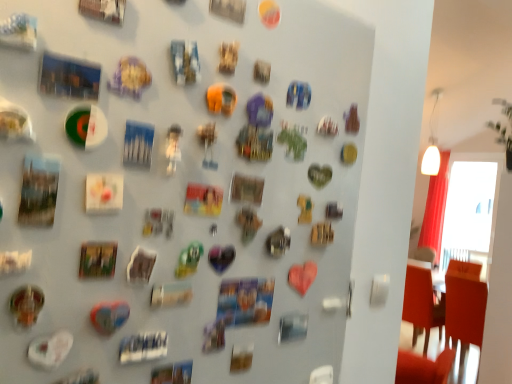
Question: Does orange fabric chair at right lie behind shiny metallic heart at center, which appears as the first art when ordered from the bottom?

Choices:
 (A) no
 (B) yes

Answer: (B)

Question: Can you confirm if orange fabric chair at right is bigger than shiny metallic heart at center, which appears as the first art when ordered from the bottom?

Choices:
 (A) no
 (B) yes

Answer: (B)

Question: From the image's perspective, would you say orange fabric chair at right is shown under shiny metallic heart at center, acting as the 6th art starting from the top?

Choices:
 (A) yes
 (B) no

Answer: (A)

Question: Does orange fabric chair at right appear on the right side of shiny metallic heart at center, acting as the 6th art starting from the top?

Choices:
 (A) no
 (B) yes

Answer: (B)

Question: Is orange fabric chair at right surrounding shiny metallic heart at center, acting as the 6th art starting from the top?

Choices:
 (A) yes
 (B) no

Answer: (B)

Question: From the image's perspective, is orange fabric chair at right on top of shiny metallic heart at center, which appears as the first art when ordered from the bottom?

Choices:
 (A) no
 (B) yes

Answer: (A)

Question: From a real-world perspective, is orange fabric chair at right positioned over metallic gold coin at lower left, the 5th art in the top-to-bottom sequence, based on gravity?

Choices:
 (A) yes
 (B) no

Answer: (B)

Question: Could you tell me if orange fabric chair at right is turned towards metallic gold coin at lower left, the 5th art in the top-to-bottom sequence?

Choices:
 (A) no
 (B) yes

Answer: (A)

Question: Is orange fabric chair at right turned away from metallic gold coin at lower left, which appears as the second art when ordered from the bottom?

Choices:
 (A) no
 (B) yes

Answer: (A)

Question: Considering the relative sizes of orange fabric chair at right and metallic gold coin at lower left, which appears as the second art when ordered from the bottom, in the image provided, is orange fabric chair at right wider than metallic gold coin at lower left, which appears as the second art when ordered from the bottom,?

Choices:
 (A) yes
 (B) no

Answer: (A)

Question: Is orange fabric chair at right to the right of metallic gold coin at lower left, which appears as the second art when ordered from the bottom, from the viewer's perspective?

Choices:
 (A) no
 (B) yes

Answer: (B)

Question: Can you confirm if orange fabric chair at right is shorter than metallic gold coin at lower left, which appears as the second art when ordered from the bottom?

Choices:
 (A) yes
 (B) no

Answer: (B)

Question: Does shiny metallic heart at center, acting as the 6th art starting from the top, lie behind white glass window screen at upper right?

Choices:
 (A) no
 (B) yes

Answer: (A)